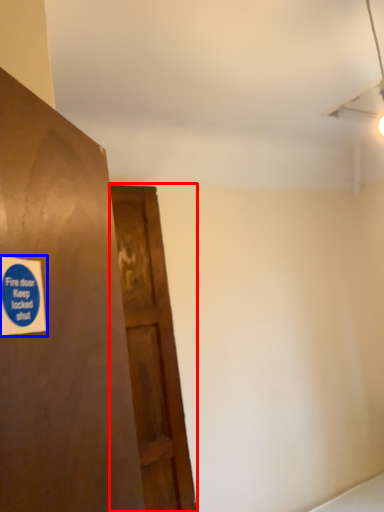
Question: Among these objects, which one is nearest to the camera, door (highlighted by a red box) or sticker (highlighted by a blue box)?

Choices:
 (A) door
 (B) sticker

Answer: (B)